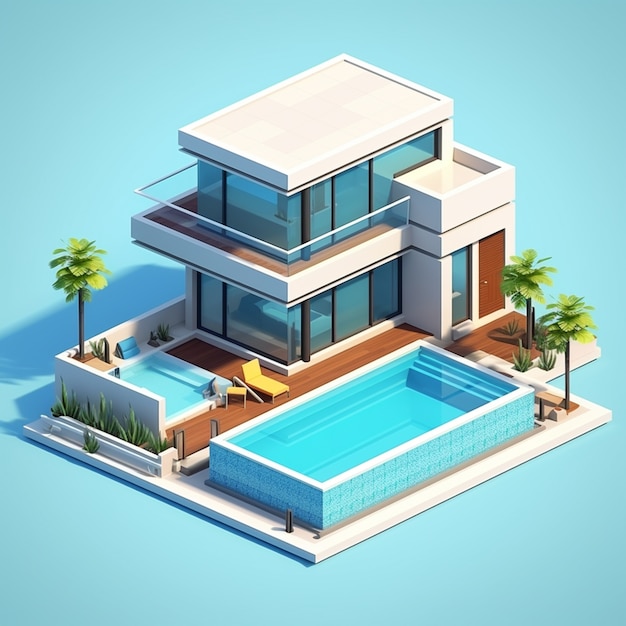
Image resolution: width=626 pixels, height=626 pixels. Find the location of `chair`. chair is located at coordinates (269, 382).